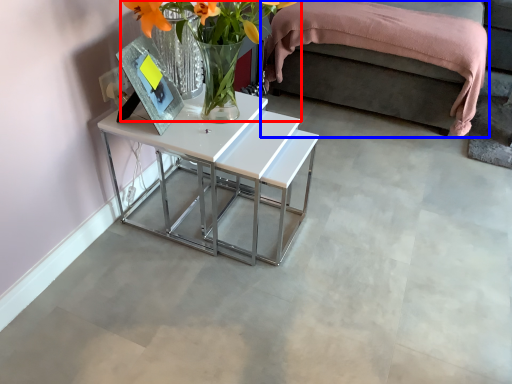
Question: Which of the following is the closest to the observer, floral arrangement (highlighted by a red box) or bed (highlighted by a blue box)?

Choices:
 (A) floral arrangement
 (B) bed

Answer: (A)